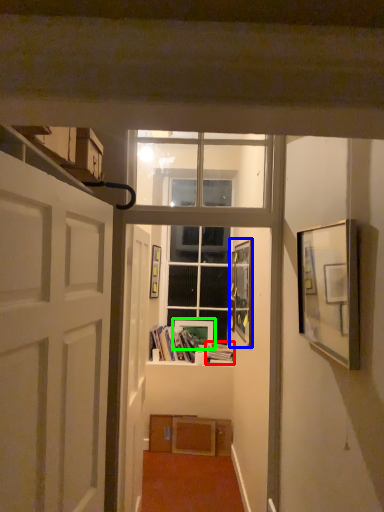
Question: Based on their relative distances, which object is farther from book (highlighted by a red box)? Choose from picture frame (highlighted by a blue box) and picture frame (highlighted by a green box).

Choices:
 (A) picture frame
 (B) picture frame

Answer: (A)